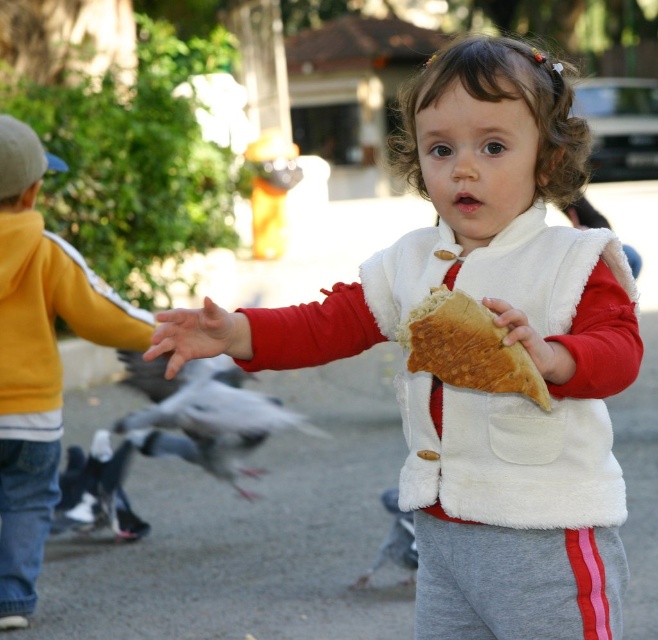
Question: Can you confirm if gray asphalt at center is bigger than gray feathered bird at center?

Choices:
 (A) no
 (B) yes

Answer: (B)

Question: Does gray feathered pigeon at lower left have a smaller size compared to gray feathered bird at center?

Choices:
 (A) no
 (B) yes

Answer: (B)

Question: Which object is closer to the camera taking this photo?

Choices:
 (A) gray feathered bird at center
 (B) gray asphalt at center

Answer: (A)

Question: Which point is farther from the camera taking this photo?

Choices:
 (A) (164, 435)
 (B) (544, 332)
 (C) (386, 552)
 (D) (9, 509)

Answer: (A)

Question: Which of the following is the farthest from the observer?

Choices:
 (A) (409, 552)
 (B) (478, 326)
 (C) (95, 492)

Answer: (C)

Question: Is yellow fleece jacket at left smaller than gray feathered bird at lower left?

Choices:
 (A) yes
 (B) no

Answer: (A)